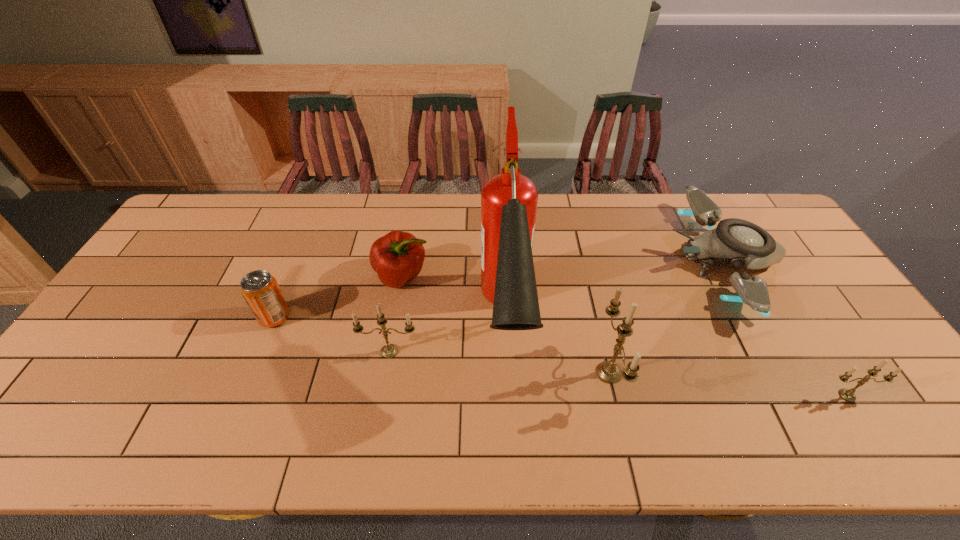
You are a GUI agent. You are given a task and a screenshot of the screen. Output one action in this format:
    pyautogui.click(x=<x>, y=<y>)
    Task: Click on the second shortest candle
    
    Given the screenshot: What is the action you would take?
    pyautogui.click(x=388, y=351)

The image size is (960, 540). I want to click on the leftmost candle, so click(x=388, y=351).

This screenshot has height=540, width=960. In order to click on the second tallest object in this screenshot , I will do `click(609, 372)`.

At what (x,y) coordinates should I click in order to perform the action: click on the second candle from right to left. Please return your answer as a coordinate pair (x, y). Looking at the image, I should click on (609, 372).

Find the location of `the shortest candle`. the shortest candle is located at coordinates (848, 395).

Where is `drone`? drone is located at coordinates (737, 242).

The height and width of the screenshot is (540, 960). Find the location of `soda can`. soda can is located at coordinates (259, 288).

Locate an element on the screen. The height and width of the screenshot is (540, 960). bell pepper is located at coordinates pos(397,257).

The width and height of the screenshot is (960, 540). In order to click on fire extinguisher in this screenshot , I will do `click(509, 200)`.

The image size is (960, 540). I want to click on the fourth object from right to left, so click(509, 200).